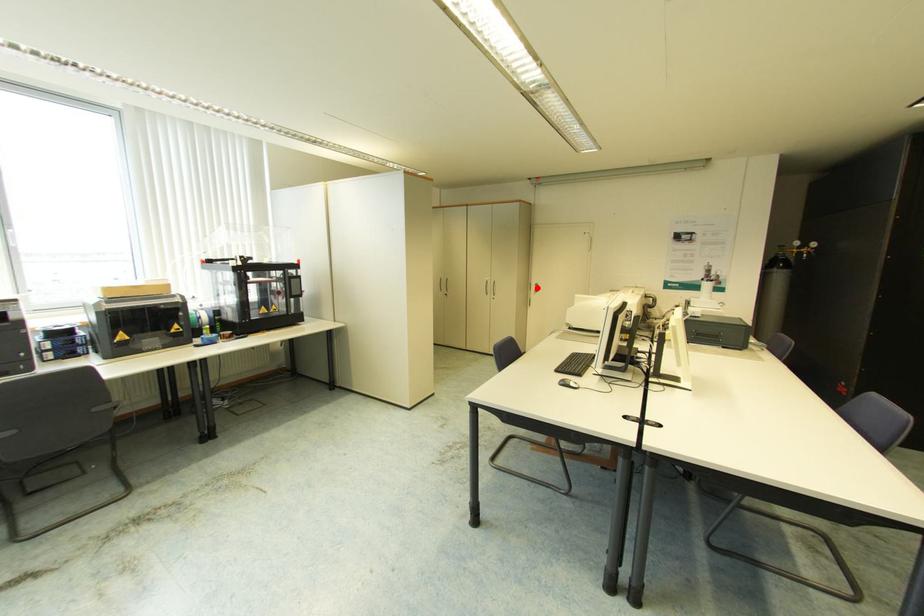
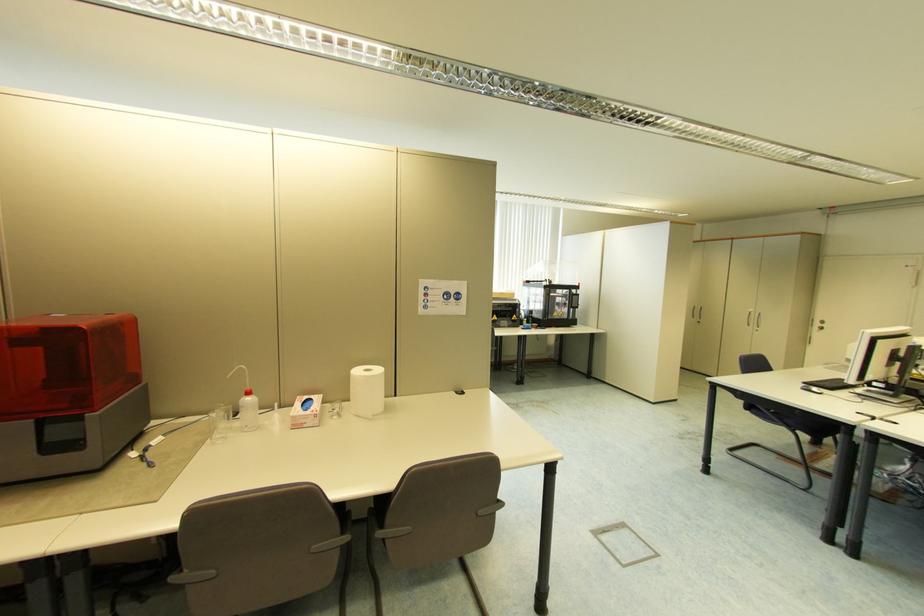
Question: A red point is marked in image1. In image2, is the corresponding 3D point closer to the camera or farther? Reply with the corresponding letter.

Choices:
 (A) The corresponding 3D point is closer.
 (B) The corresponding 3D point is farther.

Answer: (B)